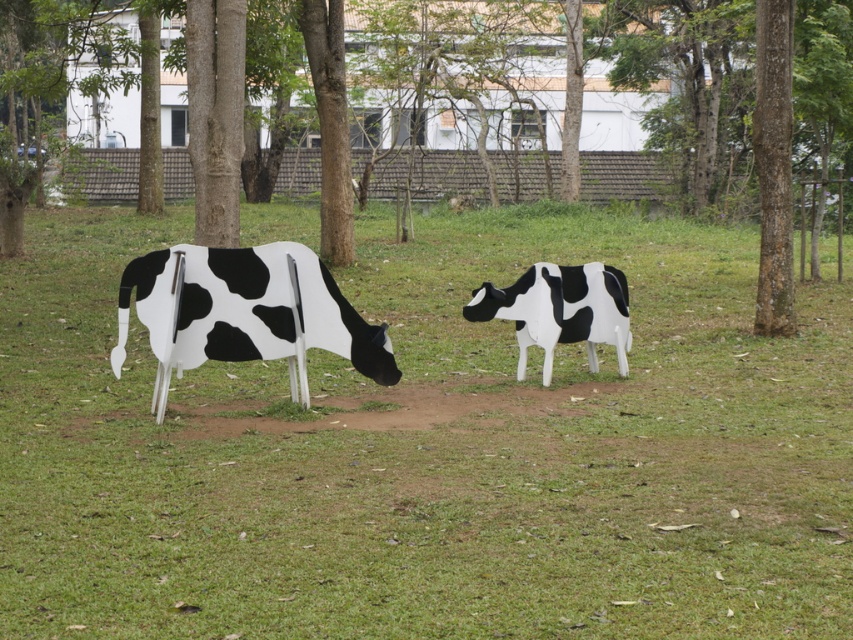
Does black and white painted cow at left have a lesser height compared to smooth bark tree at center?

Yes.

Is black and white painted cow at left thinner than smooth bark tree at center?

No, black and white painted cow at left is not thinner than smooth bark tree at center.

I want to click on black and white painted cow at left, so click(244, 314).

Is smooth bark tree at center bigger than black and white painted cow at center?

Indeed, smooth bark tree at center has a larger size compared to black and white painted cow at center.

Is smooth bark tree at center closer to the viewer compared to black and white painted cow at center?

No, smooth bark tree at center is further to the viewer.

Between point (206, 236) and point (532, 296), which one is positioned behind?

The point (206, 236) is more distant.

The image size is (853, 640). What are the coordinates of `smooth bark tree at center` in the screenshot? It's located at (215, 115).

This screenshot has width=853, height=640. Describe the element at coordinates (215, 115) in the screenshot. I see `smooth bark tree at center` at that location.

Is point (216, 120) farther from camera compared to point (761, 145)?

No, (216, 120) is in front of (761, 145).

Where is `smooth bark tree at center`? smooth bark tree at center is located at coordinates [215, 115].